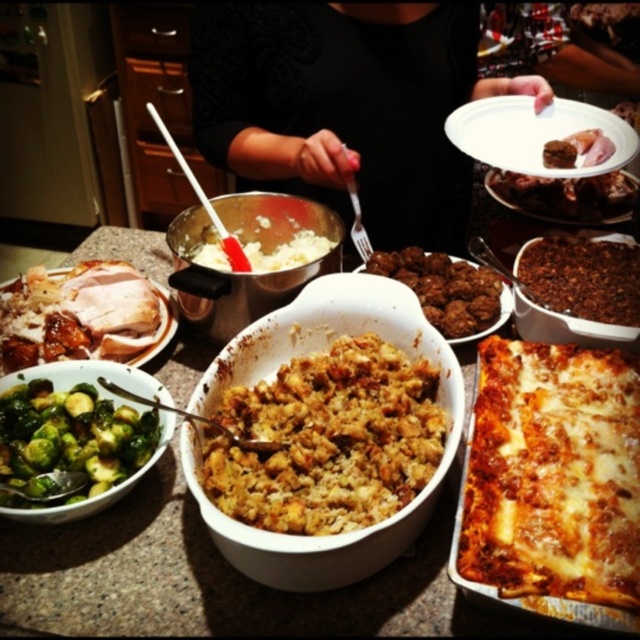
Question: Does golden brown crumbly stuffing at center appear on the left side of golden brown roasted turkey at left?

Choices:
 (A) no
 (B) yes

Answer: (A)

Question: Which point is farther from the camera taking this photo?

Choices:
 (A) (406, 397)
 (B) (564, 296)
 (C) (220, 308)

Answer: (B)

Question: Is golden brown roasted turkey at left to the left of brown crumbly stuffing at center from the viewer's perspective?

Choices:
 (A) no
 (B) yes

Answer: (B)

Question: Based on their relative distances, which object is farther from the golden brown roasted turkey at left?

Choices:
 (A) brown crispy meat at center
 (B) brown crispy skin at center

Answer: (A)

Question: Which object is the farthest from the metallic silver bowl at center?

Choices:
 (A) golden brown crumbly stuffing at center
 (B) golden cheesy lasagna at center
 (C) dark chocolate cake at center

Answer: (C)

Question: In this image, where is golden brown roasted turkey at left located relative to brown crumbly stuffing at center?

Choices:
 (A) below
 (B) above

Answer: (A)